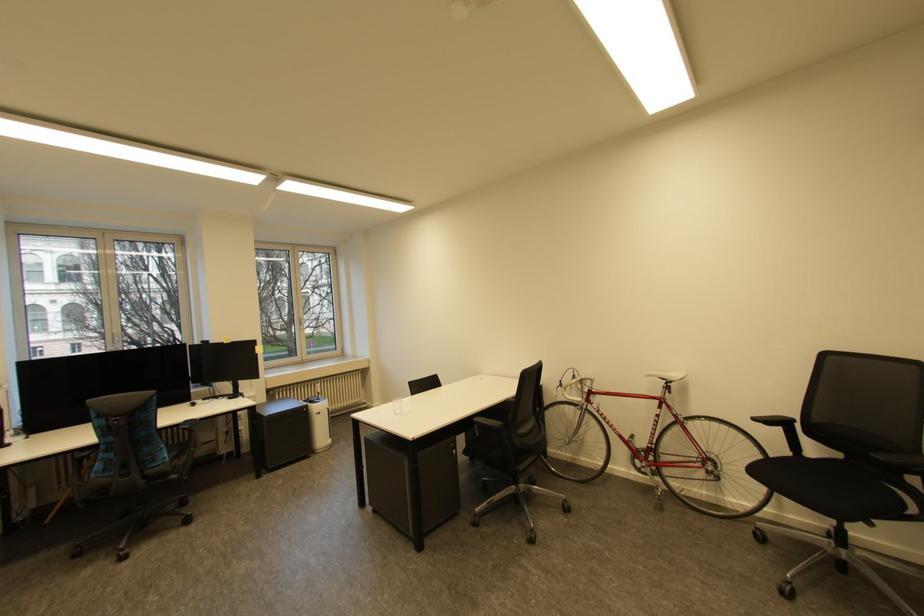
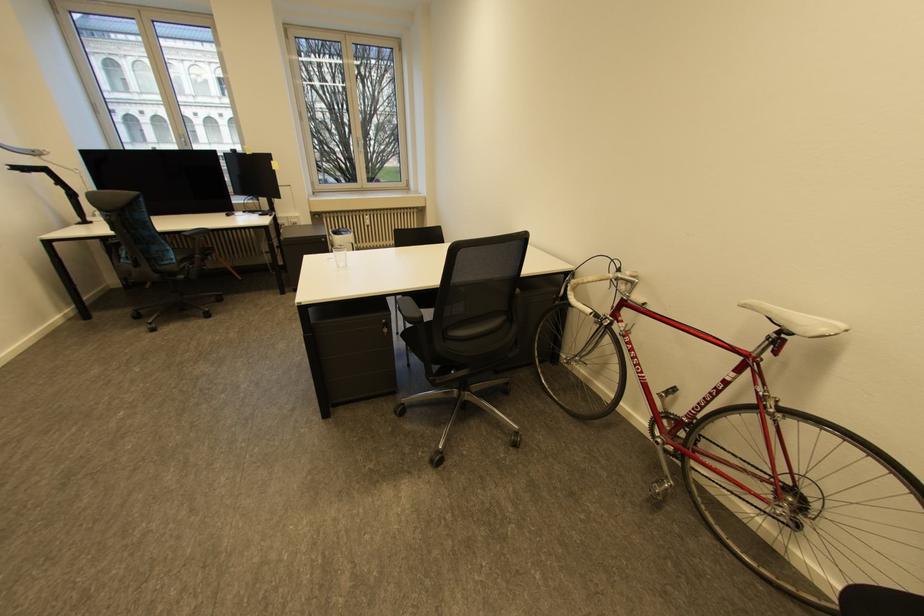
Find the pixel in the second image that matches point 325,394 in the first image.

(374, 227)